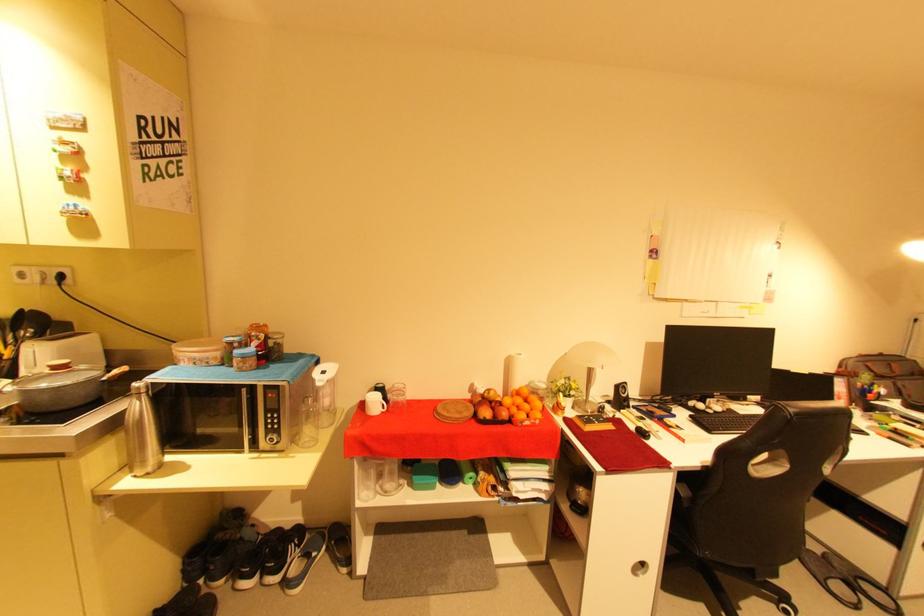
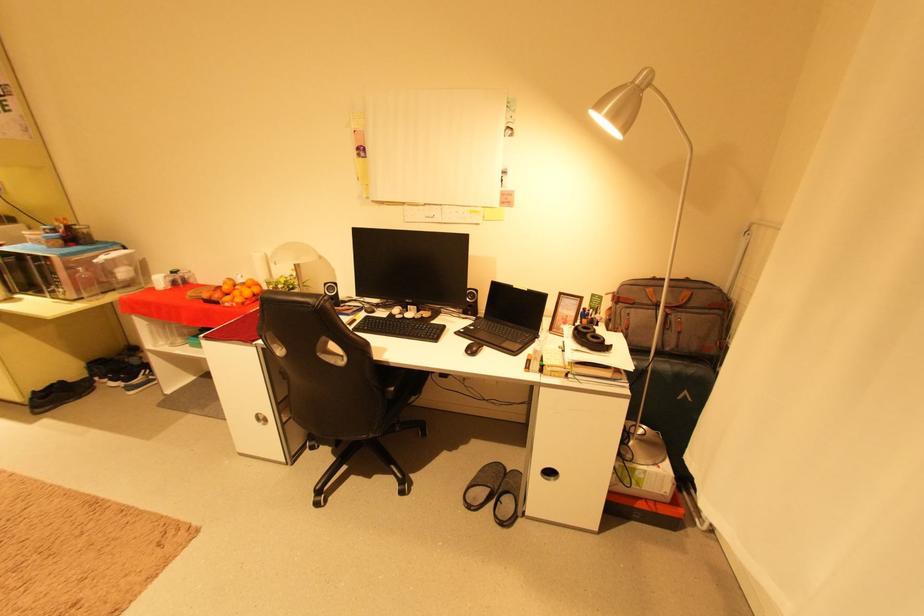
Where in the second image is the point corresponding to point (535, 424) from the first image?

(235, 305)